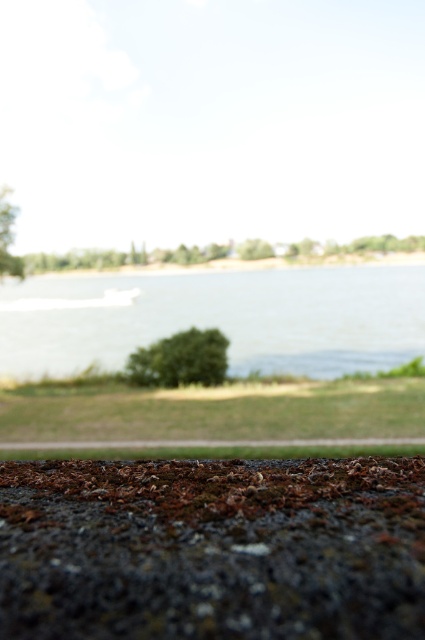
Who is more distant from viewer, (209, 314) or (393, 442)?

Point (209, 314)

In the scene shown: Who is positioned more to the right, clear water at center or brown gravel curb at lower center?

brown gravel curb at lower center

Is point (303, 280) farther from viewer compared to point (91, 444)?

Yes, point (303, 280) is farther from viewer.

The width and height of the screenshot is (425, 640). I want to click on clear water at center, so click(218, 317).